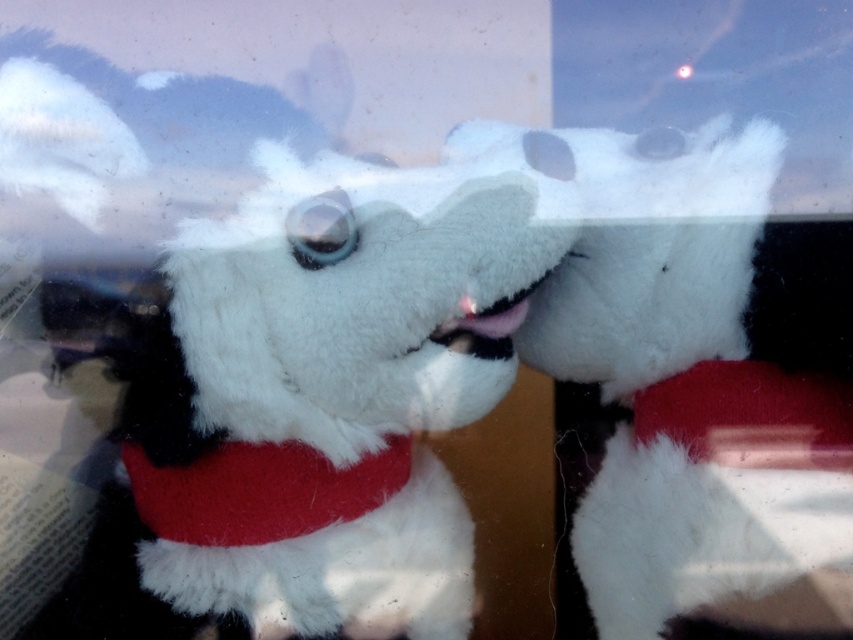
Question: Which object is closer to the camera taking this photo?

Choices:
 (A) white plush dog at center
 (B) red plush neckband at center

Answer: (A)

Question: Is white plush dog at center smaller than red plush neckband at center?

Choices:
 (A) yes
 (B) no

Answer: (B)

Question: Can you confirm if white plush dog at center is smaller than red plush neckband at center?

Choices:
 (A) no
 (B) yes

Answer: (A)

Question: Which object is closer to the camera taking this photo?

Choices:
 (A) red plush neckband at center
 (B) white plush dog at center

Answer: (B)

Question: Is white plush dog at center below red plush neckband at center?

Choices:
 (A) no
 (B) yes

Answer: (A)

Question: Which object appears farthest from the camera in this image?

Choices:
 (A) white plush dog at center
 (B) red plush neckband at center

Answer: (B)